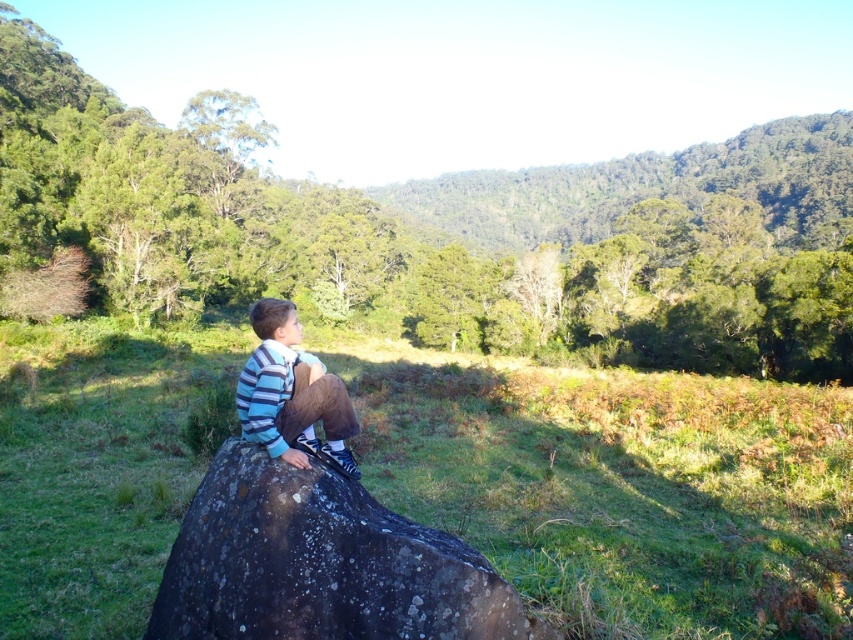
Question: Among these points, which one is farthest from the camera?

Choices:
 (A) (404, 520)
 (B) (258, 433)

Answer: (A)

Question: Is speckled dark rock at center closer to the viewer compared to striped cotton shirt at center?

Choices:
 (A) no
 (B) yes

Answer: (B)

Question: Can you confirm if speckled dark rock at center is smaller than striped cotton shirt at center?

Choices:
 (A) yes
 (B) no

Answer: (A)

Question: Does speckled dark rock at center appear on the left side of striped cotton shirt at center?

Choices:
 (A) yes
 (B) no

Answer: (B)

Question: Which point is closer to the camera taking this photo?

Choices:
 (A) (281, 470)
 (B) (281, 301)

Answer: (A)